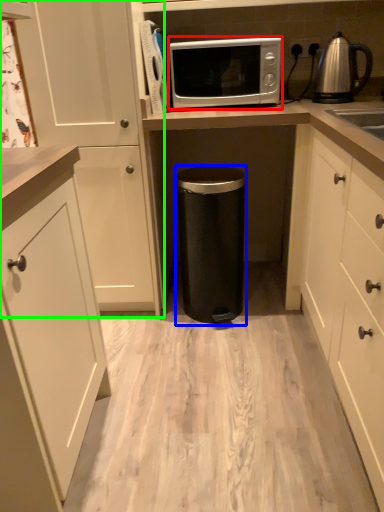
Question: Which object is the closest to the microwave oven (highlighted by a red box)? Choose among these: appliance (highlighted by a blue box) or cabinetry (highlighted by a green box).

Choices:
 (A) appliance
 (B) cabinetry

Answer: (B)